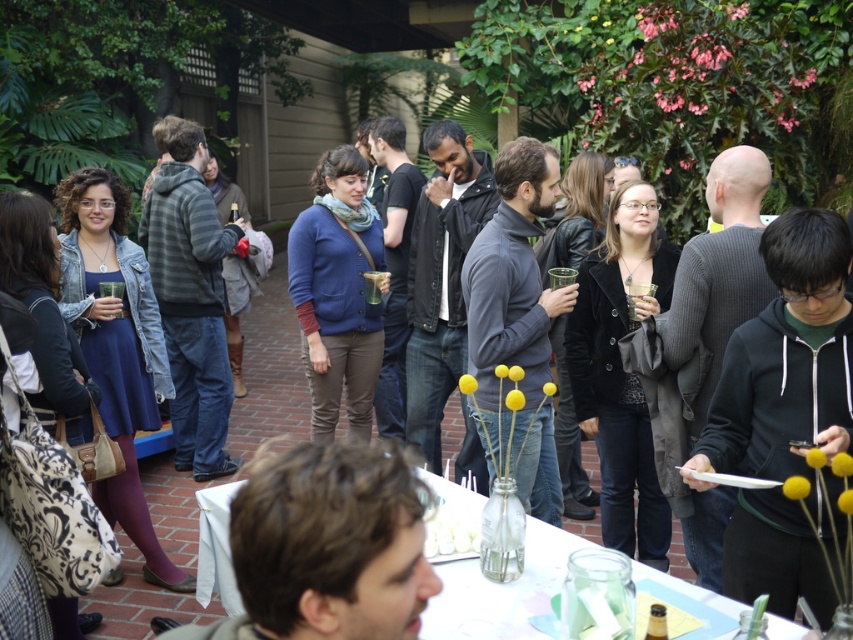
Question: Does white paper plate at center come behind white frosted cake at center?

Choices:
 (A) yes
 (B) no

Answer: (B)

Question: Which of the following is the farthest from the observer?

Choices:
 (A) white frosted cake at center
 (B) white paper plate at center

Answer: (A)

Question: Can you confirm if white paper plate at center is positioned above white frosted cake at center?

Choices:
 (A) no
 (B) yes

Answer: (A)

Question: Which point appears farthest from the camera in this image?

Choices:
 (A) (200, 586)
 (B) (451, 509)

Answer: (A)

Question: Which object is farther from the camera taking this photo?

Choices:
 (A) white frosted cake at center
 (B) white paper plate at center

Answer: (A)

Question: Is white paper plate at center below white frosted cake at center?

Choices:
 (A) yes
 (B) no

Answer: (A)